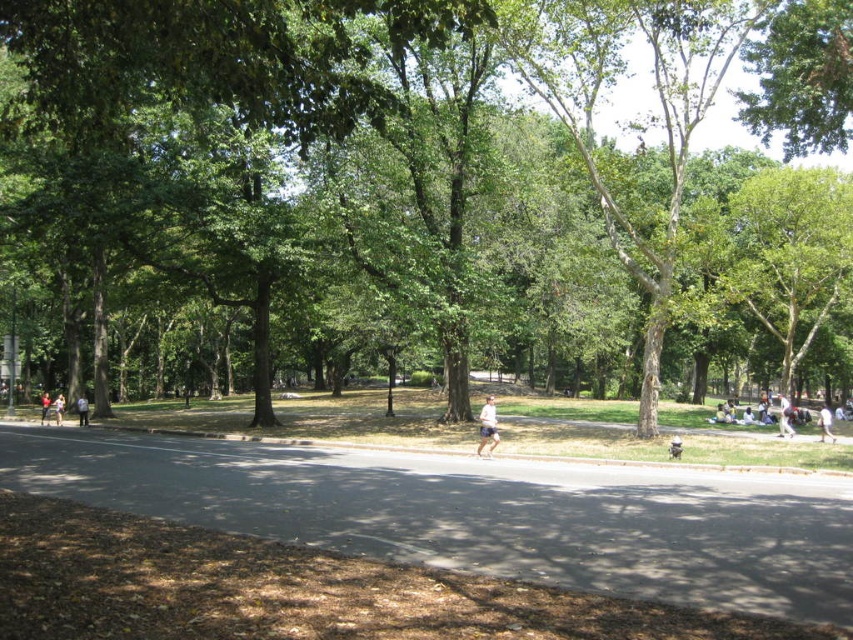
You are a photographer positioned at the park entrance and want to capture both the white cotton shirt at lower right and the light blue fabric shirt at right in a single photo. Which person should you focus on first to ensure both are in the frame?

You should focus on the white cotton shirt at lower right first because it is in front of the light blue fabric shirt at right, ensuring both are included in the photo.

You are standing on the asphalt road at center and want to see the light blue fabric shirt at right. Which direction should you look to see it?

The light blue fabric shirt at right is behind the asphalt road at center, so you should look behind you to see it.